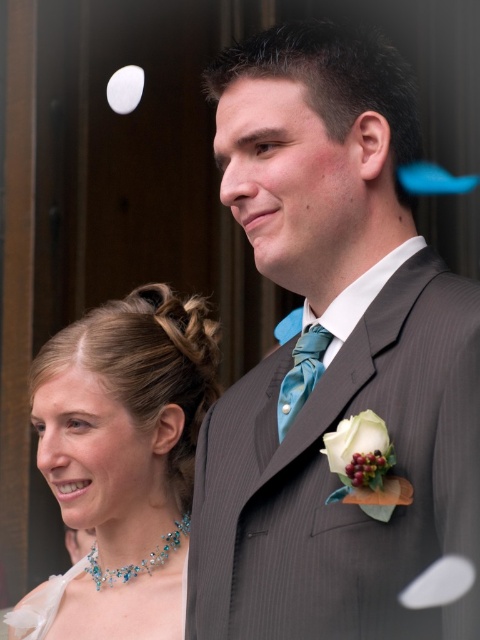
You are a photographer at a wedding and need to adjust the lighting to ensure both the teal satin tie at center and the shiny blue beaded necklace at lower left are visible. Which object should you focus on first to account for their positions?

The teal satin tie at center is closer to the viewer than the shiny blue beaded necklace at lower left, so you should focus on the teal satin tie at center first to ensure proper lighting.